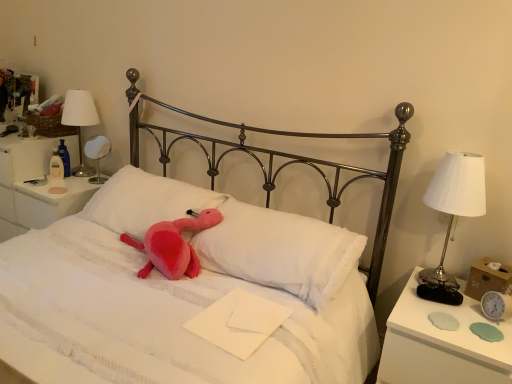
Question: Are white plastic nightstand at left, acting as the 1th nightstand starting from the left, and white fabric lampshade at right, the first bedside lamp from the right, located far from each other?

Choices:
 (A) no
 (B) yes

Answer: (B)

Question: Does white plastic nightstand at left, the first nightstand in the top-to-bottom sequence, have a greater height compared to white fabric lampshade at right, which appears as the third bedside lamp when viewed from the left?

Choices:
 (A) no
 (B) yes

Answer: (B)

Question: Does white plastic nightstand at left, acting as the 1th nightstand starting from the left, have a lesser width compared to white fabric lampshade at right, which appears as the third bedside lamp when viewed from the left?

Choices:
 (A) yes
 (B) no

Answer: (B)

Question: Is white plastic nightstand at left, the first nightstand from the back, facing towards white fabric lampshade at right, which ranks as the first bedside lamp in front-to-back order?

Choices:
 (A) no
 (B) yes

Answer: (A)

Question: From the image's perspective, does white plastic nightstand at left, arranged as the 2th nightstand when ordered from the bottom, appear lower than white fabric lampshade at right, which ranks as the first bedside lamp in front-to-back order?

Choices:
 (A) yes
 (B) no

Answer: (B)

Question: From a real-world perspective, is white plastic nightstand at left, arranged as the 2th nightstand when ordered from the bottom, positioned under white fabric lampshade at right, the first bedside lamp from the right, based on gravity?

Choices:
 (A) no
 (B) yes

Answer: (B)

Question: From the image's perspective, is fluffy pink pillow at center, which is the 1th pillow from left to right, located beneath pink plush toy at center?

Choices:
 (A) yes
 (B) no

Answer: (B)

Question: Is fluffy pink pillow at center, which is the 1th pillow from left to right, completely or partially outside of pink plush toy at center?

Choices:
 (A) yes
 (B) no

Answer: (B)

Question: From a real-world perspective, is fluffy pink pillow at center, the second pillow from the right, located higher than pink plush toy at center?

Choices:
 (A) yes
 (B) no

Answer: (A)

Question: Is fluffy pink pillow at center, which is the 1th pillow from left to right, closer to camera compared to pink plush toy at center?

Choices:
 (A) yes
 (B) no

Answer: (B)

Question: Considering the relative positions of fluffy pink pillow at center, the second pillow from the right, and pink plush toy at center in the image provided, is fluffy pink pillow at center, the second pillow from the right, behind pink plush toy at center?

Choices:
 (A) no
 (B) yes

Answer: (B)

Question: Does fluffy pink pillow at center, which is the 1th pillow from left to right, have a smaller size compared to pink plush toy at center?

Choices:
 (A) yes
 (B) no

Answer: (A)

Question: Is silver metallic clock at right thinner than white soft pillow at center, acting as the first pillow starting from the right?

Choices:
 (A) yes
 (B) no

Answer: (A)